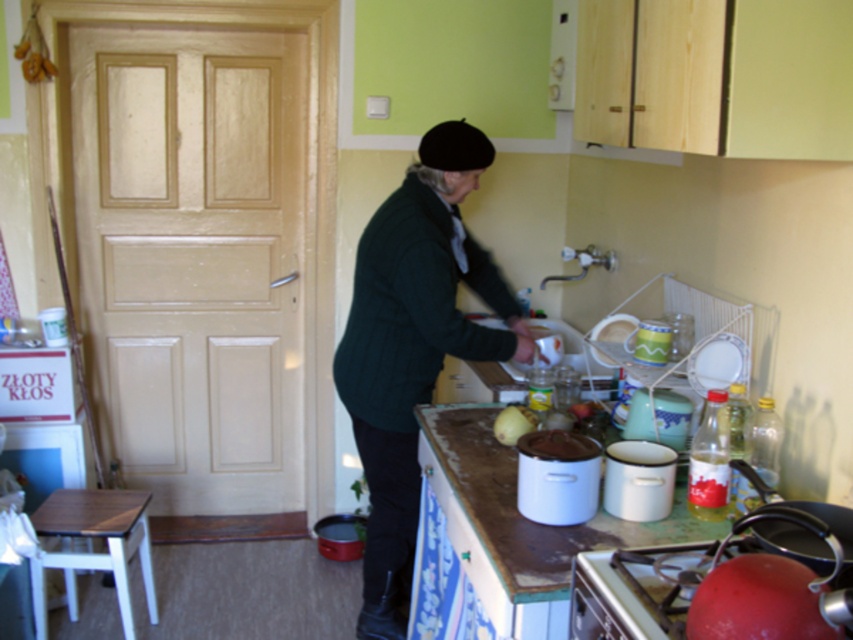
Which of these two, brown wood at lower center or metallic silver stove at lower right, stands taller?

brown wood at lower center is taller.

Can you confirm if brown wood at lower center is taller than metallic silver stove at lower right?

Indeed, brown wood at lower center has a greater height compared to metallic silver stove at lower right.

Who is more forward, (474, 436) or (686, 548)?

Point (686, 548) is in front.

Where is `brown wood at lower center`? The image size is (853, 640). brown wood at lower center is located at coordinates (527, 518).

Can you confirm if dark green sweater at center is taller than yellow matte onion at center?

Indeed, dark green sweater at center has a greater height compared to yellow matte onion at center.

Who is taller, dark green sweater at center or yellow matte onion at center?

dark green sweater at center is taller.

Is point (492, 278) positioned in front of point (527, 416)?

No.

Find the location of `dark green sweater at center`. dark green sweater at center is located at coordinates (413, 346).

Is metallic silver stove at lower right wider than yellow matte onion at center?

Correct, the width of metallic silver stove at lower right exceeds that of yellow matte onion at center.

Between metallic silver stove at lower right and yellow matte onion at center, which one is positioned lower?

metallic silver stove at lower right is below.

Measure the distance between metallic silver stove at lower right and camera.

metallic silver stove at lower right and camera are 3.67 feet apart from each other.

Where is `metallic silver stove at lower right`? The image size is (853, 640). metallic silver stove at lower right is located at coordinates (635, 589).